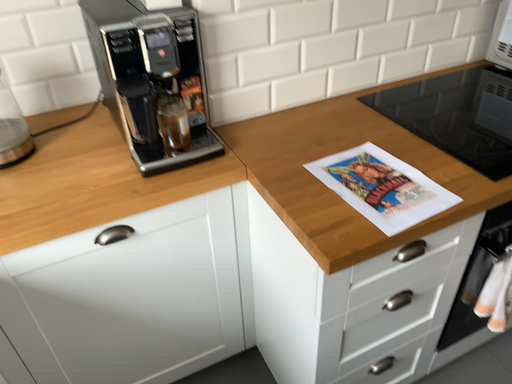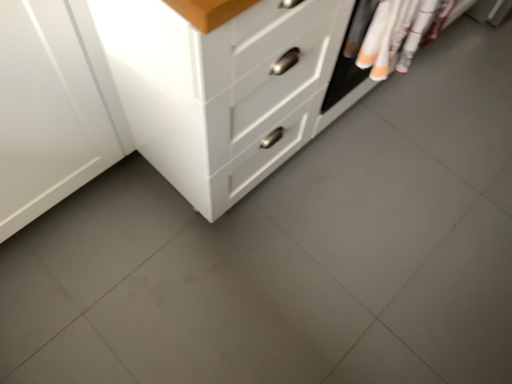
Question: How did the camera likely rotate when shooting the video?

Choices:
 (A) rotated downward
 (B) rotated upward

Answer: (A)